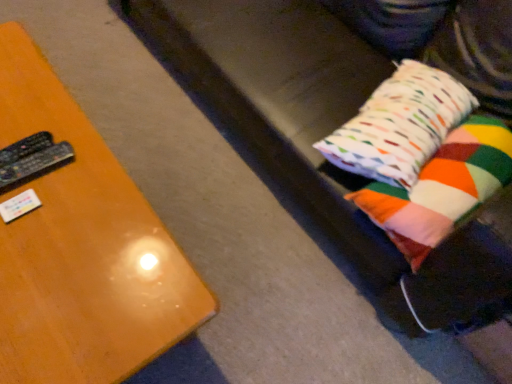
Question: Is black plastic remote at left, placed as the 1th remote when sorted from top to bottom, inside the boundaries of multicolored fabric pillow at right, the 1th pillow from the top, or outside?

Choices:
 (A) inside
 (B) outside

Answer: (B)

Question: Is black plastic remote at left, which is the second remote in bottom-to-top order, wider or thinner than multicolored fabric pillow at right, which is the 2th pillow in bottom-to-top order?

Choices:
 (A) wide
 (B) thin

Answer: (B)

Question: Which object is the farthest from the black plastic remote at left, which is counted as the 1th remote, starting from the bottom?

Choices:
 (A) multicolored fabric pillow at right, arranged as the 1th pillow when ordered from the bottom
 (B) wooden table at left
 (C) black plastic remote at left, placed as the 1th remote when sorted from top to bottom
 (D) multicolored fabric pillow at right, the 1th pillow from the top

Answer: (A)

Question: Which is nearer to the black plastic remote at left, which is counted as the 1th remote, starting from the bottom?

Choices:
 (A) multicolored fabric pillow at right, the 1th pillow from the top
 (B) wooden table at left
 (C) multicolored fabric pillow at right, arranged as the 1th pillow when ordered from the bottom
 (D) black plastic remote at left, placed as the 1th remote when sorted from top to bottom

Answer: (D)